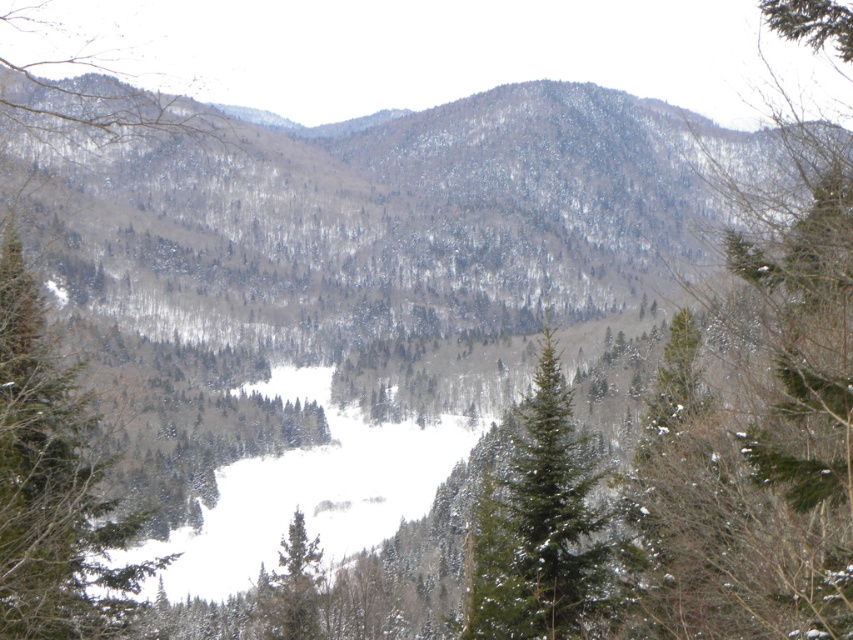
Question: Based on their relative distances, which object is nearer to the green matte tree at center-left?

Choices:
 (A) green matte tree at lower center
 (B) green textured pine at center
 (C) green matte tree at center

Answer: (C)

Question: Does green matte tree at center-left appear over green matte tree at center?

Choices:
 (A) no
 (B) yes

Answer: (B)

Question: Is green textured pine at center smaller than green matte tree at lower center?

Choices:
 (A) no
 (B) yes

Answer: (A)

Question: Considering the real-world distances, which object is closest to the green textured pine at center?

Choices:
 (A) green matte tree at lower center
 (B) green matte tree at center

Answer: (B)

Question: Which of the following is the farthest from the observer?

Choices:
 (A) pyautogui.click(x=306, y=588)
 (B) pyautogui.click(x=666, y=504)
 (C) pyautogui.click(x=554, y=624)
 (D) pyautogui.click(x=10, y=349)

Answer: (A)

Question: Does green matte tree at center-left have a lesser width compared to green matte tree at lower center?

Choices:
 (A) yes
 (B) no

Answer: (A)